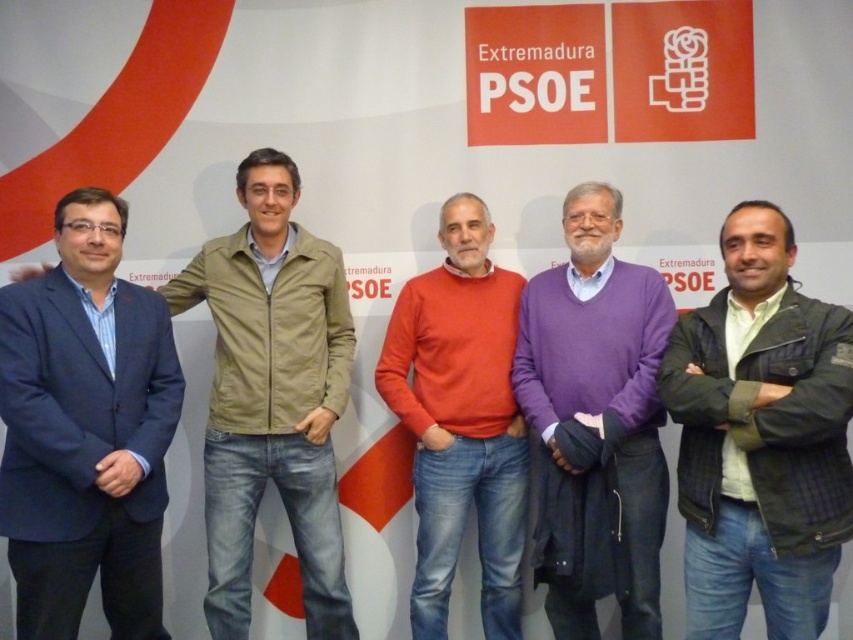
You are observing a group photo of five men in front of a political backdrop. You notice the khaki fabric jacket at left and the purple sweater at center. Which clothing item is positioned higher in the image?

The khaki fabric jacket at left is positioned higher in the image than the purple sweater at center.

You are a photographer taking a group photo of the five men in front of the Extremadura PSOE backdrop. You notice the khaki fabric jacket at left and the matte orange sweater at center. Which clothing item is closer to the camera?

The khaki fabric jacket at left is closer to the camera because it is in front of the matte orange sweater at center.